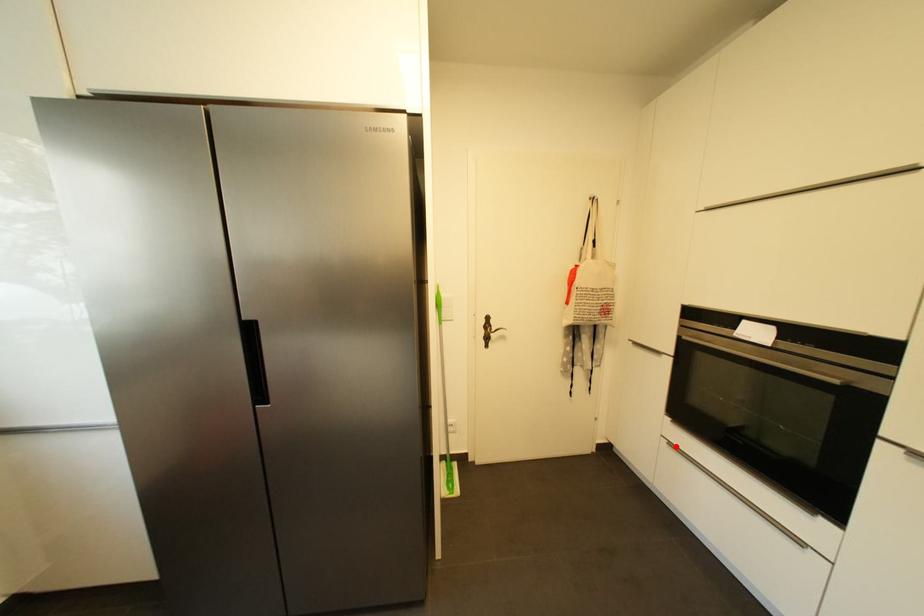
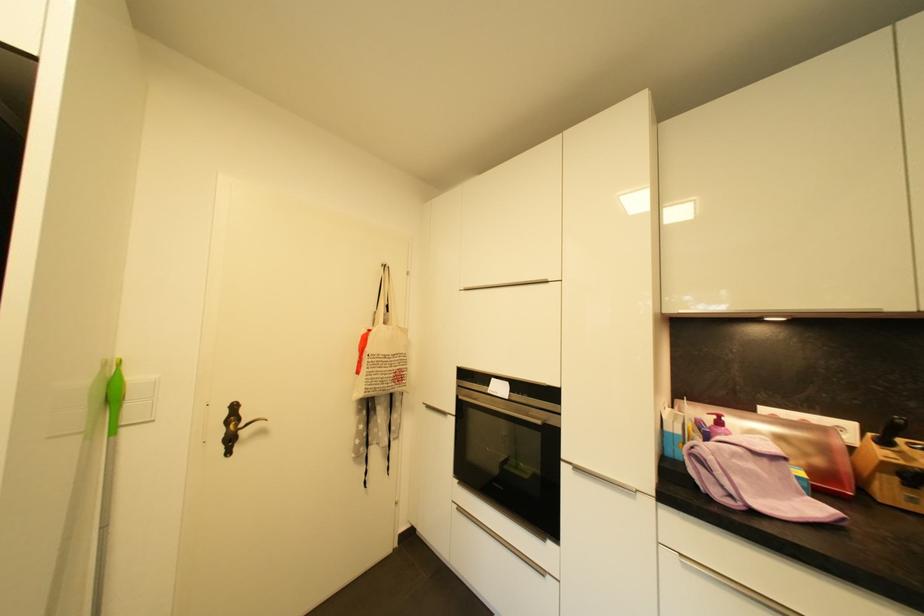
Question: I am providing you with two images of the same scene from different viewpoints. In image1, a red point is highlighted. Considering the same 3D point in image2, which of the following is correct?

Choices:
 (A) It is closer
 (B) It is farther

Answer: (B)